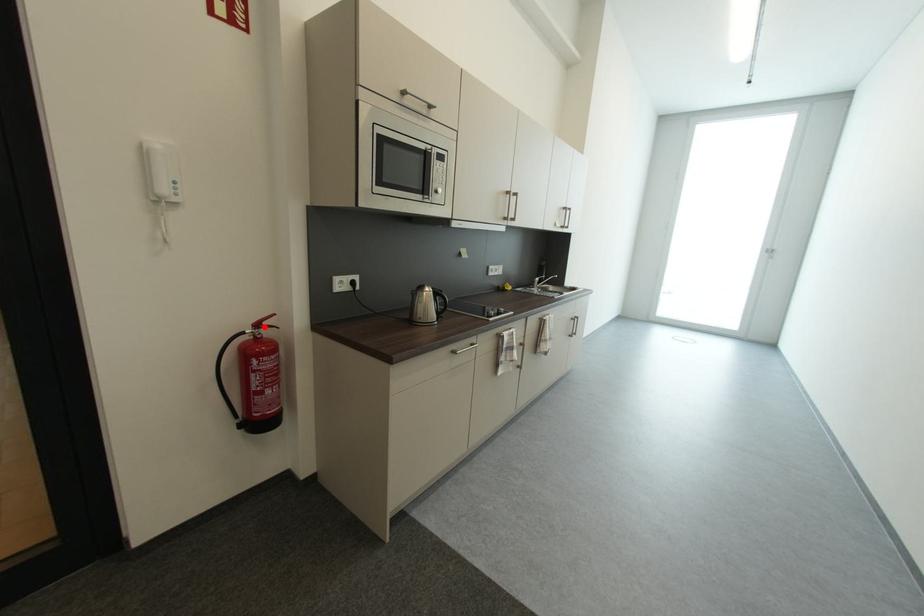
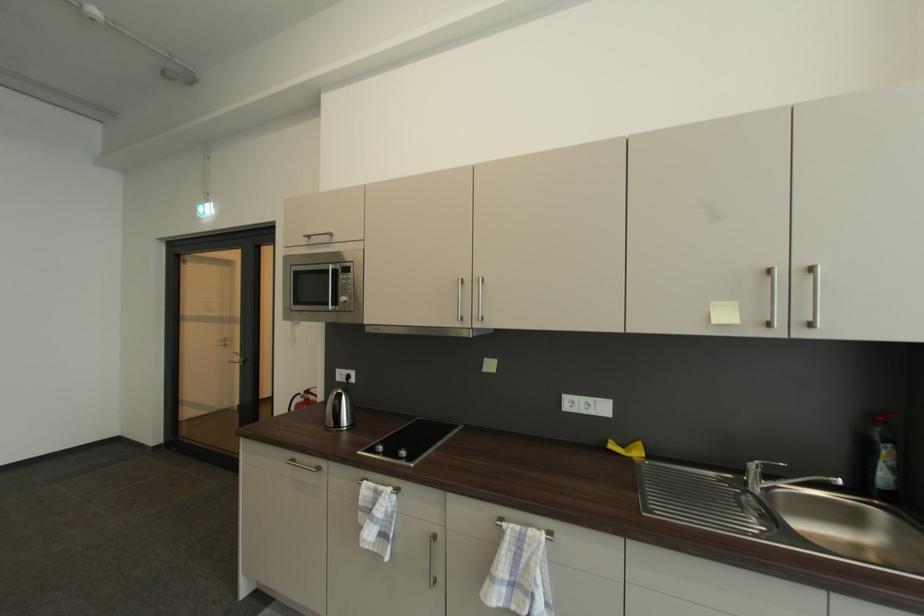
Question: I am providing you with two images of the same scene from different viewpoints. A red point is marked on the first image. Is the red point's position out of view in image 2?

Choices:
 (A) Yes
 (B) No

Answer: (B)